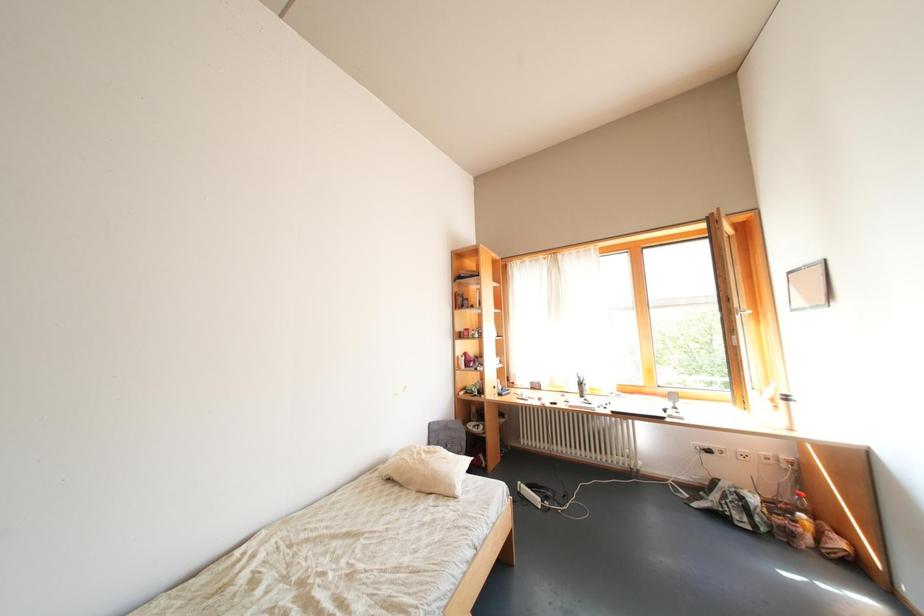
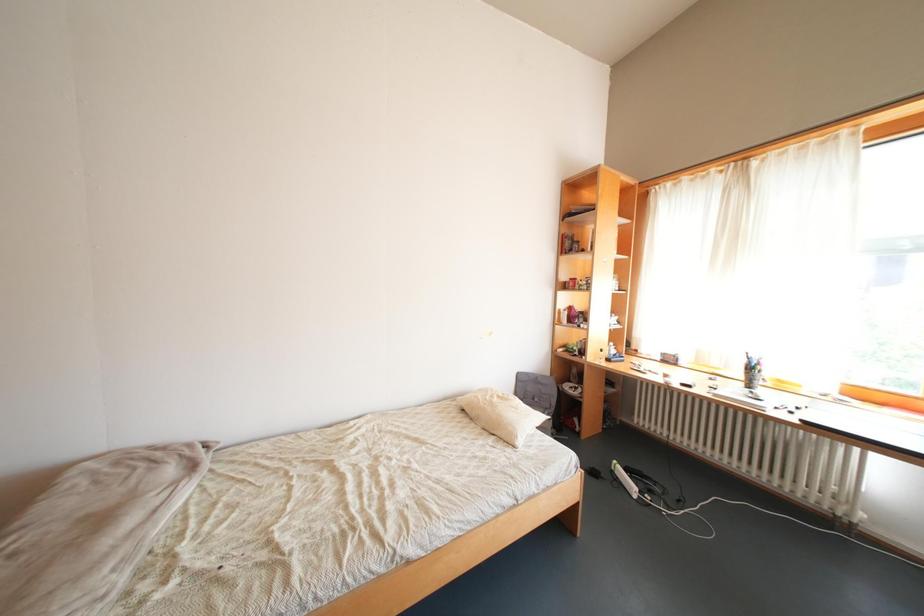
Question: How did the camera likely rotate?

Choices:
 (A) Left
 (B) Right
 (C) Up
 (D) Down

Answer: (A)